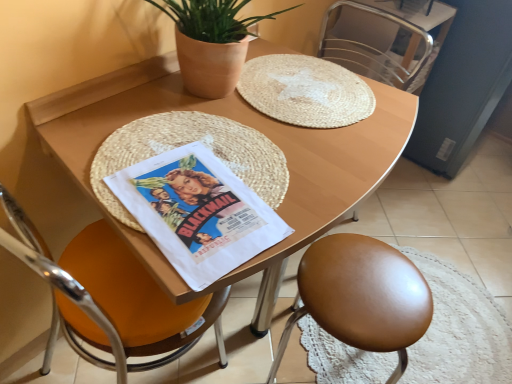
In the scene shown: Measure the distance between point (415,63) and camera.

The depth of point (415,63) is 1.61 meters.

Measure the distance between wooden table at center and camera.

wooden table at center is 25.21 inches from camera.

What are the coordinates of `brown leather stool at lower right, which is the 2th chair in right-to-left order` in the screenshot? It's located at [361, 297].

Where is `metallic silver chair at upper right, the third chair from the left`? This screenshot has width=512, height=384. metallic silver chair at upper right, the third chair from the left is located at coordinates coord(371,43).

From the picture: From a real-world perspective, is wooden table at center under metallic silver chair at upper right, positioned as the 1th chair in right-to-left order?

Indeed, from a real-world perspective, wooden table at center is positioned beneath metallic silver chair at upper right, positioned as the 1th chair in right-to-left order.

Considering the sizes of objects wooden table at center and metallic silver chair at upper right, positioned as the 1th chair in right-to-left order, in the image provided, who is thinner, wooden table at center or metallic silver chair at upper right, positioned as the 1th chair in right-to-left order,?

With smaller width is metallic silver chair at upper right, positioned as the 1th chair in right-to-left order.

Is wooden table at center to the left or to the right of metallic silver chair at upper right, positioned as the 1th chair in right-to-left order, in the image?

Clearly, wooden table at center is on the left of metallic silver chair at upper right, positioned as the 1th chair in right-to-left order, in the image.

From the image's perspective, is wooden table at center positioned above or below metallic silver chair at upper right, the third chair from the left?

Based on their image positions, wooden table at center is located beneath metallic silver chair at upper right, the third chair from the left.

Is terracotta pot at upper center aimed at white paper comic book at center?

No, terracotta pot at upper center is not turned towards white paper comic book at center.

Is terracotta pot at upper center wider than white paper comic book at center?

In fact, terracotta pot at upper center might be narrower than white paper comic book at center.

Does terracotta pot at upper center have a smaller size compared to white paper comic book at center?

Actually, terracotta pot at upper center might be larger than white paper comic book at center.

Can you confirm if orange leather chair at left, the third chair positioned from the right, is shorter than metallic silver chair at upper right, the third chair from the left?

Incorrect, the height of orange leather chair at left, the third chair positioned from the right, does not fall short of that of metallic silver chair at upper right, the third chair from the left.

Is orange leather chair at left, the 1th chair from the left, wider or thinner than metallic silver chair at upper right, positioned as the 1th chair in right-to-left order?

orange leather chair at left, the 1th chair from the left, is wider than metallic silver chair at upper right, positioned as the 1th chair in right-to-left order.

Measure the distance from orange leather chair at left, the 1th chair from the left, to metallic silver chair at upper right, positioned as the 1th chair in right-to-left order.

A distance of 3.72 feet exists between orange leather chair at left, the 1th chair from the left, and metallic silver chair at upper right, positioned as the 1th chair in right-to-left order.

Is metallic silver chair at upper right, the third chair from the left, a part of orange leather chair at left, the third chair positioned from the right?

No, metallic silver chair at upper right, the third chair from the left, is not inside orange leather chair at left, the third chair positioned from the right.

Is orange leather chair at left, the third chair positioned from the right, not close to white paper comic book at center?

No, there isn't a large distance between orange leather chair at left, the third chair positioned from the right, and white paper comic book at center.

Considering the relative sizes of orange leather chair at left, the third chair positioned from the right, and white paper comic book at center in the image provided, is orange leather chair at left, the third chair positioned from the right, smaller than white paper comic book at center?

Actually, orange leather chair at left, the third chair positioned from the right, might be larger than white paper comic book at center.

Is orange leather chair at left, the 1th chair from the left, to the right of white paper comic book at center from the viewer's perspective?

Incorrect, orange leather chair at left, the 1th chair from the left, is not on the right side of white paper comic book at center.

How much distance is there between orange leather chair at left, the third chair positioned from the right, and white paper comic book at center?

They are 11.75 inches apart.

Which object is further away from the camera taking this photo, metallic silver chair at upper right, the third chair from the left, or terracotta pot at upper center?

metallic silver chair at upper right, the third chair from the left.

Do you think metallic silver chair at upper right, the third chair from the left, is within terracotta pot at upper center, or outside of it?

metallic silver chair at upper right, the third chair from the left, is spatially situated outside terracotta pot at upper center.

Who is smaller, metallic silver chair at upper right, positioned as the 1th chair in right-to-left order, or terracotta pot at upper center?

Smaller between the two is metallic silver chair at upper right, positioned as the 1th chair in right-to-left order.

Could you tell me if metallic silver chair at upper right, the third chair from the left, is turned towards terracotta pot at upper center?

Yes, metallic silver chair at upper right, the third chair from the left, is facing terracotta pot at upper center.

How different are the orientations of brown leather stool at lower right, which is the 2th chair in right-to-left order, and terracotta pot at upper center in degrees?

brown leather stool at lower right, which is the 2th chair in right-to-left order, and terracotta pot at upper center are facing 180 degrees away from each other.

The image size is (512, 384). Identify the location of the 3rd chair positioned below the terracotta pot at upper center (from a real-world perspective). (361, 297).

Is brown leather stool at lower right, which is the 2th chair in right-to-left order, facing towards terracotta pot at upper center?

No, brown leather stool at lower right, which is the 2th chair in right-to-left order, does not turn towards terracotta pot at upper center.

Can you see brown leather stool at lower right, the 2th chair positioned from the left, touching terracotta pot at upper center?

They are not placed beside each other.

Is brown leather stool at lower right, the 2th chair positioned from the left, not within orange leather chair at left, the third chair positioned from the right?

brown leather stool at lower right, the 2th chair positioned from the left, is positioned outside orange leather chair at left, the third chair positioned from the right.

Is brown leather stool at lower right, which is the 2th chair in right-to-left order, further to camera compared to orange leather chair at left, the 1th chair from the left?

That is True.

Which object is positioned more to the right, brown leather stool at lower right, which is the 2th chair in right-to-left order, or orange leather chair at left, the 1th chair from the left?

brown leather stool at lower right, which is the 2th chair in right-to-left order, is more to the right.

In the scene shown: Is brown leather stool at lower right, the 2th chair positioned from the left, smaller than orange leather chair at left, the third chair positioned from the right?

Correct, brown leather stool at lower right, the 2th chair positioned from the left, occupies less space than orange leather chair at left, the third chair positioned from the right.

Locate an element on the screen. desk below the metallic silver chair at upper right, the third chair from the left (from the image's perspective) is located at coordinates (245, 124).

Where is `houseplant behind the white paper comic book at center`? This screenshot has width=512, height=384. houseplant behind the white paper comic book at center is located at coordinates (211, 43).

Estimate the real-world distances between objects in this image. Which object is closer to terracotta pot at upper center, white paper comic book at center or orange leather chair at left, the third chair positioned from the right?

The object closer to terracotta pot at upper center is white paper comic book at center.

Which object lies nearer to the anchor point metallic silver chair at upper right, positioned as the 1th chair in right-to-left order, white paper comic book at center or brown leather stool at lower right, the 2th chair positioned from the left?

Among the two, brown leather stool at lower right, the 2th chair positioned from the left, is located nearer to metallic silver chair at upper right, positioned as the 1th chair in right-to-left order.

Based on their spatial positions, is wooden table at center or white paper comic book at center closer to metallic silver chair at upper right, positioned as the 1th chair in right-to-left order?

wooden table at center lies closer to metallic silver chair at upper right, positioned as the 1th chair in right-to-left order, than the other object.

Based on their spatial positions, is metallic silver chair at upper right, positioned as the 1th chair in right-to-left order, or white paper comic book at center closer to wooden table at center?

Based on the image, white paper comic book at center appears to be nearer to wooden table at center.

When comparing their distances from brown leather stool at lower right, the 2th chair positioned from the left, does metallic silver chair at upper right, positioned as the 1th chair in right-to-left order, or wooden table at center seem further?

Based on the image, metallic silver chair at upper right, positioned as the 1th chair in right-to-left order, appears to be further to brown leather stool at lower right, the 2th chair positioned from the left.

Based on the photo, considering their positions, is white paper comic book at center positioned further to brown leather stool at lower right, which is the 2th chair in right-to-left order, than metallic silver chair at upper right, positioned as the 1th chair in right-to-left order?

metallic silver chair at upper right, positioned as the 1th chair in right-to-left order, is further to brown leather stool at lower right, which is the 2th chair in right-to-left order.

Looking at the image, which one is located further to wooden table at center, brown leather stool at lower right, which is the 2th chair in right-to-left order, or white paper comic book at center?

brown leather stool at lower right, which is the 2th chair in right-to-left order, is further to wooden table at center.

Considering their positions, is metallic silver chair at upper right, positioned as the 1th chair in right-to-left order, positioned closer to brown leather stool at lower right, which is the 2th chair in right-to-left order, than orange leather chair at left, the 1th chair from the left?

Based on the image, orange leather chair at left, the 1th chair from the left, appears to be nearer to brown leather stool at lower right, which is the 2th chair in right-to-left order.

You are a GUI agent. You are given a task and a screenshot of the screen. Output one action in this format:
    pyautogui.click(x=<x>, y=<y>)
    Task: Click on the desk situated between orange leather chair at left, the third chair positioned from the right, and brown leather stool at lower right, which is the 2th chair in right-to-left order, from left to right
    The height and width of the screenshot is (384, 512).
    Given the screenshot: What is the action you would take?
    pyautogui.click(x=245, y=124)

I want to click on houseplant positioned between wooden table at center and metallic silver chair at upper right, the third chair from the left, from near to far, so click(211, 43).

At what (x,y) coordinates should I click in order to perform the action: click on comic book between orange leather chair at left, the third chair positioned from the right, and brown leather stool at lower right, which is the 2th chair in right-to-left order, in the horizontal direction. Please return your answer as a coordinate pair (x, y). The width and height of the screenshot is (512, 384). Looking at the image, I should click on (197, 212).

Find the location of a particular element. This screenshot has height=384, width=512. comic book between wooden table at center and metallic silver chair at upper right, positioned as the 1th chair in right-to-left order, from front to back is located at coordinates (197, 212).